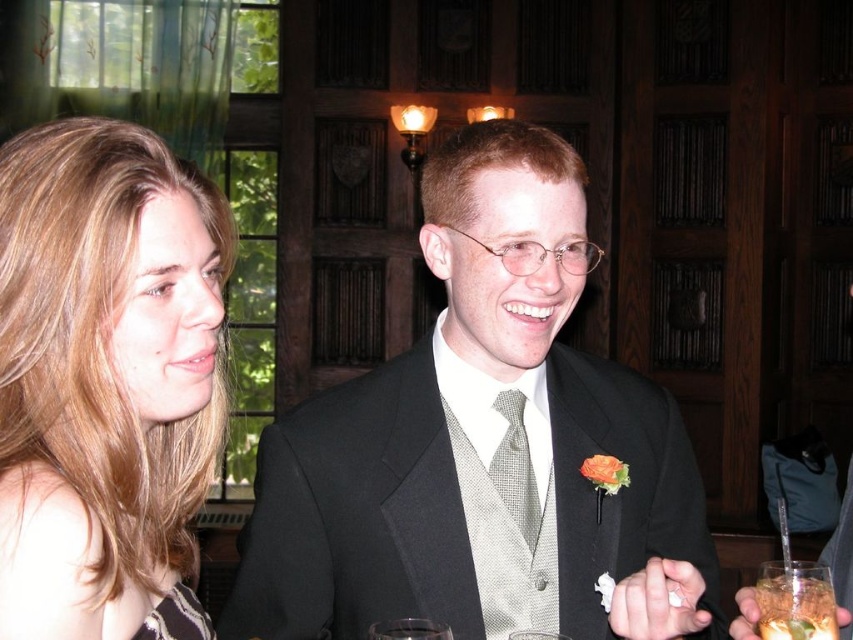
You are at a formal event and notice two points marked in the room. The first point is at coordinates point (x=788, y=602) and the second is at point (x=193, y=614). Which point is closer to you as you stand facing the room?

Point (x=193, y=614) is closer to you because it is in front of point (x=788, y=602), which is behind it.

You are an artist trying to sketch this scene. You want to place the blonde hair at left accurately. According to the coordinates provided, where should you position it on your canvas?

The blonde hair at left should be positioned at the coordinates point [103,372] on the canvas.

You are a photographer adjusting your camera settings to capture the translucent glass beverage at lower right. The camera is set to focus at 1 meter. Will the beverage be in focus?

The translucent glass beverage at lower right is 95.75 centimeters away from the camera. Since the focus is set at 1 meter, there will be a slight distance difference of 4.25 centimeters. Depending on the camera lens and aperture used, the beverage may or may not be in focus. However, at such a close distance to the focus point, it might still be acceptably sharp.